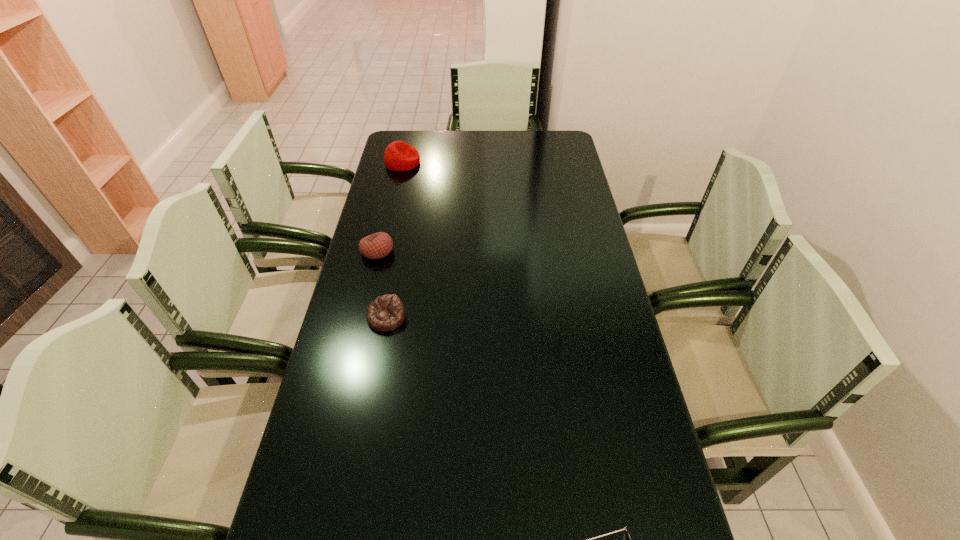
Locate an element on the screen. The image size is (960, 540). beanbag that is the closest to the shortest beanbag is located at coordinates (378, 245).

Select which beanbag appears as the second closest to the second tallest object. Please provide its 2D coordinates. Your answer should be formatted as a tuple, i.e. [(x, y)], where the tuple contains the x and y coordinates of a point satisfying the conditions above.

[(399, 156)]

The height and width of the screenshot is (540, 960). In order to click on free space that satisfies the following two spatial constraints: 1. on the back side of the shortest beanbag; 2. on the seat area of the tallest object in this screenshot , I will do `click(416, 163)`.

You are a GUI agent. You are given a task and a screenshot of the screen. Output one action in this format:
    pyautogui.click(x=<x>, y=<y>)
    Task: Click on the vacant space that satisfies the following two spatial constraints: 1. on the front side of the third farthest object; 2. on the left side of the third nearest object
    Image resolution: width=960 pixels, height=540 pixels.
    Given the screenshot: What is the action you would take?
    pyautogui.click(x=361, y=318)

This screenshot has width=960, height=540. What are the coordinates of `vacant space that satisfies the following two spatial constraints: 1. on the seat area of the tallest beanbag; 2. on the right side of the second nearest object` in the screenshot? It's located at (368, 318).

Locate an element on the screen. The width and height of the screenshot is (960, 540). vacant space that satisfies the following two spatial constraints: 1. on the seat area of the farthest beanbag; 2. on the back side of the shortest beanbag is located at coordinates (368, 318).